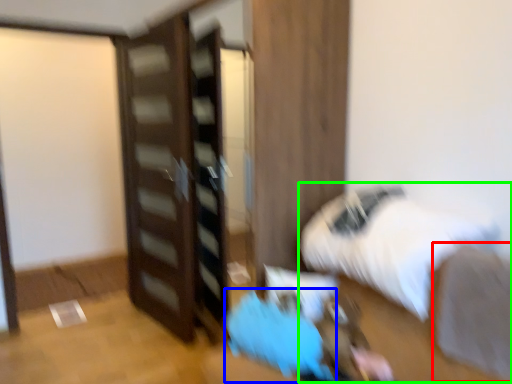
Question: Considering the real-world distances, which object is closest to sheet (highlighted by a red box)? bean bag chair (highlighted by a blue box) or bed (highlighted by a green box).

Choices:
 (A) bean bag chair
 (B) bed

Answer: (B)